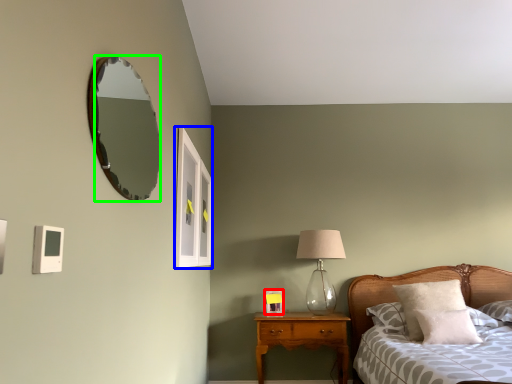
Question: Considering the real-world distances, which object is closest to picture frame (highlighted by a red box)? window (highlighted by a blue box) or mirror (highlighted by a green box).

Choices:
 (A) window
 (B) mirror

Answer: (A)